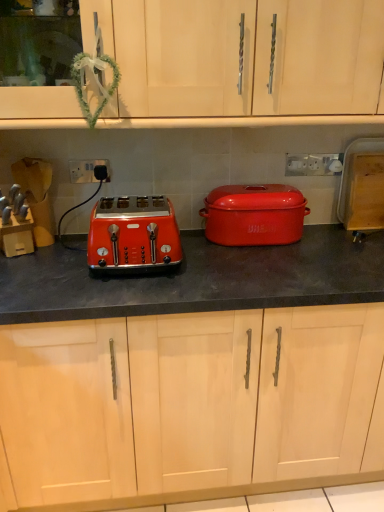
What are the coordinates of `vacant space in front of matte orange toaster at left` in the screenshot? It's located at (129, 293).